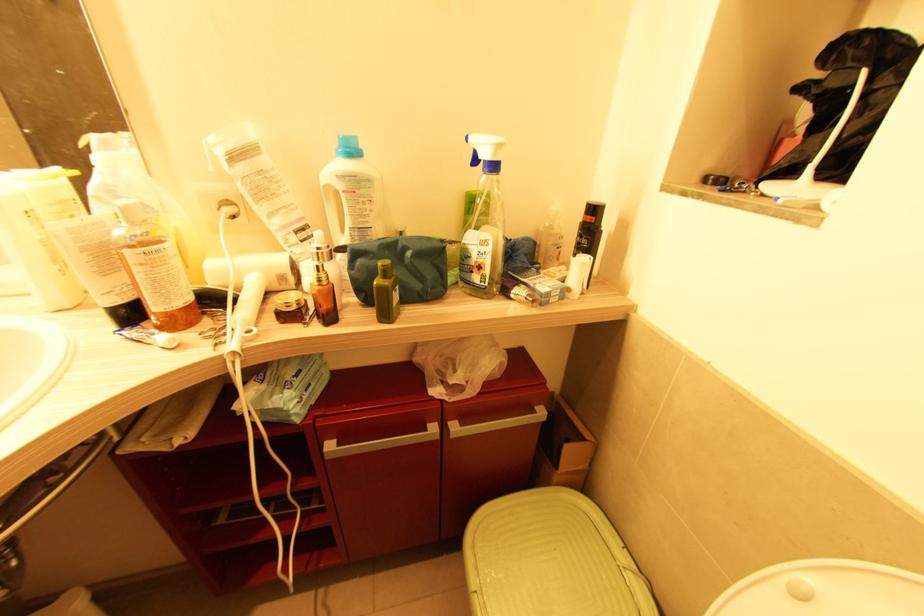
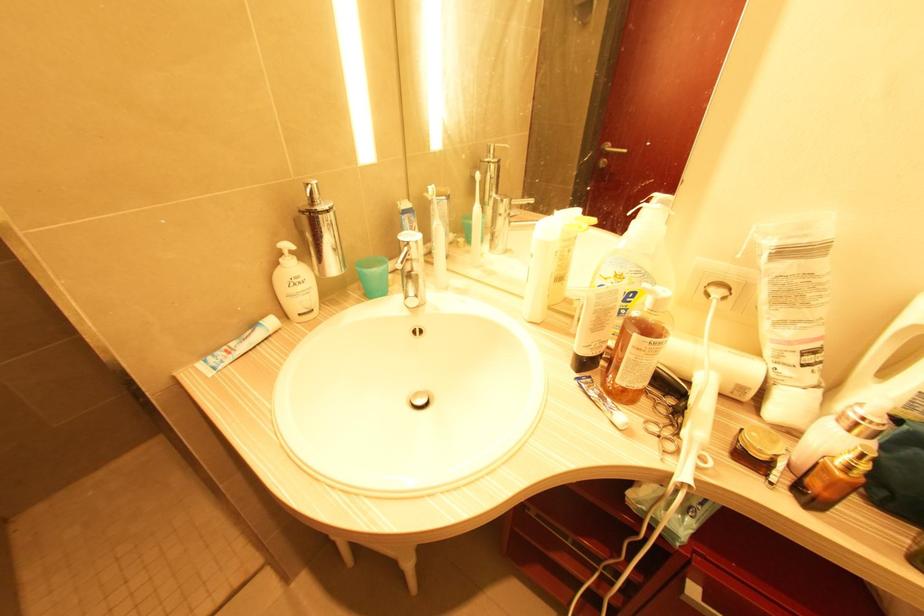
Find the pixel in the second image that matches the point at 225,339 in the first image.

(671, 448)